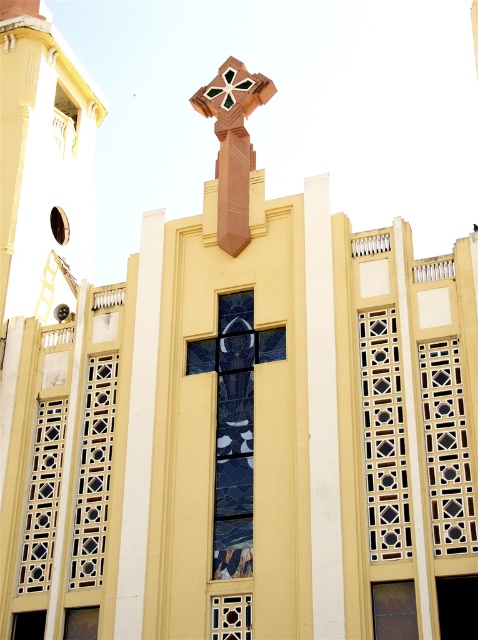
Looking at this image, does translucent glass window at left have a lesser width compared to clear glass window at lower right?

In fact, translucent glass window at left might be wider than clear glass window at lower right.

Does translucent glass window at left lie in front of clear glass window at lower right?

No, translucent glass window at left is further to the viewer.

Identify the location of translucent glass window at left. (94, 472).

Between brown polished wood cross at upper center and wooden stained glass cross at center, which one has less height?

With less height is wooden stained glass cross at center.

This screenshot has width=478, height=640. Find the location of `brown polished wood cross at upper center`. brown polished wood cross at upper center is located at coordinates (232, 145).

This screenshot has height=640, width=478. What do you see at coordinates (232, 145) in the screenshot? I see `brown polished wood cross at upper center` at bounding box center [232, 145].

Locate an element on the screen. The image size is (478, 640). brown polished wood cross at upper center is located at coordinates (232, 145).

Does translucent glass lattice at left have a smaller size compared to matte brown window at lower left?

No, translucent glass lattice at left is not smaller than matte brown window at lower left.

At what (x,y) coordinates should I click in order to perform the action: click on translucent glass lattice at left. Please return your answer as a coordinate pair (x, y). Looking at the image, I should click on (43, 497).

Which is in front, point (29, 524) or point (73, 628)?

Point (73, 628) is in front.

I want to click on translucent glass lattice at left, so click(x=43, y=497).